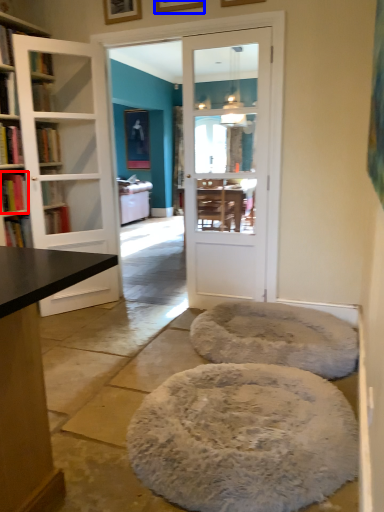
Question: Which point is closer to the camera, book (highlighted by a red box) or picture frame (highlighted by a blue box)?

Choices:
 (A) book
 (B) picture frame

Answer: (B)